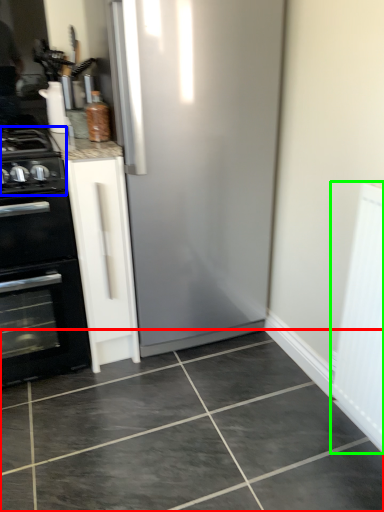
Question: Considering the real-world distances, which object is closest to ceramic tile (highlighted by a red box)? gas stove (highlighted by a blue box) or screen door (highlighted by a green box).

Choices:
 (A) gas stove
 (B) screen door

Answer: (B)